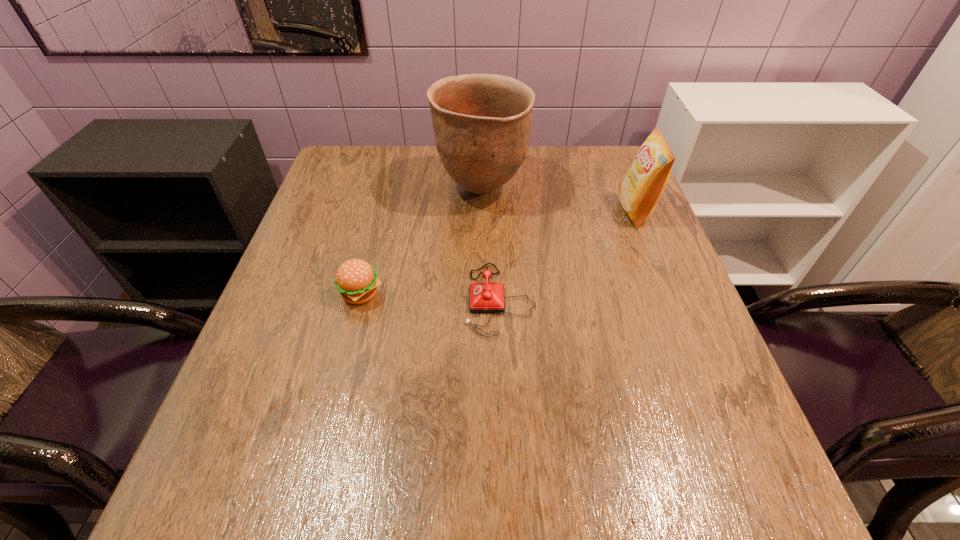
Find the location of `free space located on the left of the second shortest object`. free space located on the left of the second shortest object is located at coordinates (287, 294).

The width and height of the screenshot is (960, 540). Find the location of `free space located on the dial of the shortest object`. free space located on the dial of the shortest object is located at coordinates (395, 300).

In order to click on free location located on the dial of the shortest object in this screenshot , I will do (x=419, y=300).

Identify the location of free point located 0.350m on the dial of the shortest object. (300, 300).

Locate an element on the screen. object that is at the far edge is located at coordinates (482, 122).

Find the location of a particular element. This screenshot has width=960, height=540. object positioned at the left edge is located at coordinates (356, 280).

Image resolution: width=960 pixels, height=540 pixels. Identify the location of object that is at the right edge. (640, 190).

In order to click on free spot at the far edge of the desktop in this screenshot , I will do `click(544, 173)`.

Identify the location of vacant space at the near edge of the desktop. This screenshot has height=540, width=960. (549, 495).

Locate an element on the screen. This screenshot has width=960, height=540. blank space at the left edge of the desktop is located at coordinates (362, 219).